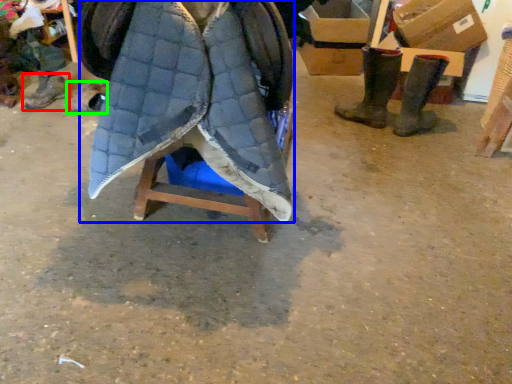
Question: Considering the real-world distances, which object is closest to footwear (highlighted by a red box)? cloak (highlighted by a blue box) or footwear (highlighted by a green box).

Choices:
 (A) cloak
 (B) footwear

Answer: (B)